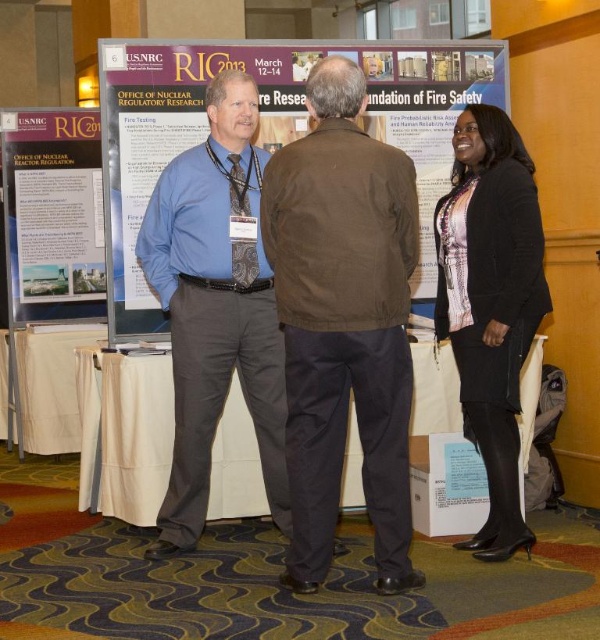
Question: Observing the image, what is the correct spatial positioning of matte blue shirt at center in reference to matte paper poster at left?

Choices:
 (A) right
 (B) left

Answer: (A)

Question: Which of the following is the farthest from the observer?

Choices:
 (A) black woolen coat at right
 (B) matte paper poster at left
 (C) matte blue shirt at center
 (D) brown leather jacket at center

Answer: (B)

Question: Considering the real-world distances, which object is closest to the black woolen coat at right?

Choices:
 (A) matte paper poster at left
 (B) matte blue shirt at center
 (C) brown leather jacket at center

Answer: (C)

Question: Which of the following is the farthest from the observer?

Choices:
 (A) matte paper poster at left
 (B) matte blue shirt at center

Answer: (A)

Question: Can you confirm if matte blue shirt at center is positioned to the right of black woolen coat at right?

Choices:
 (A) no
 (B) yes

Answer: (A)

Question: Is black woolen coat at right smaller than matte paper poster at left?

Choices:
 (A) no
 (B) yes

Answer: (A)